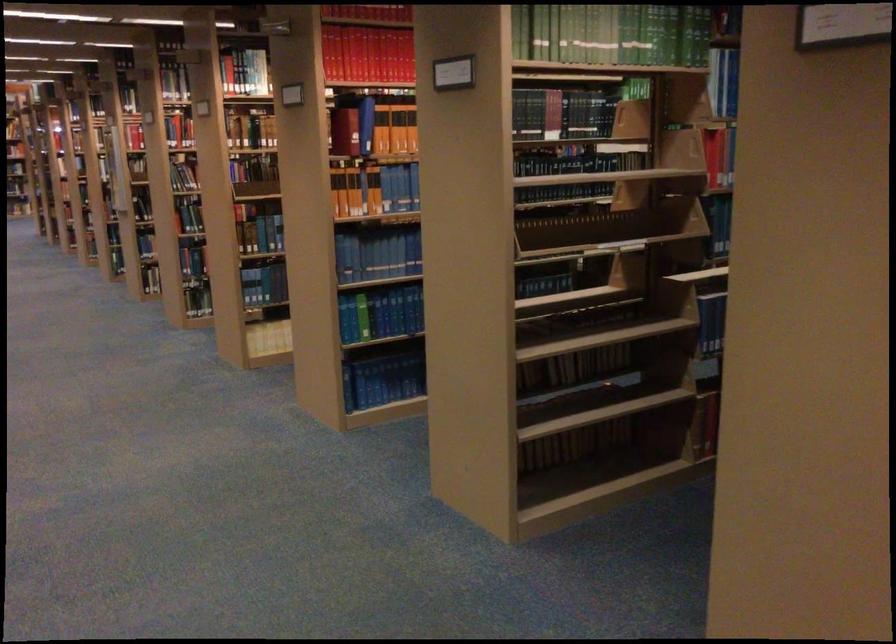
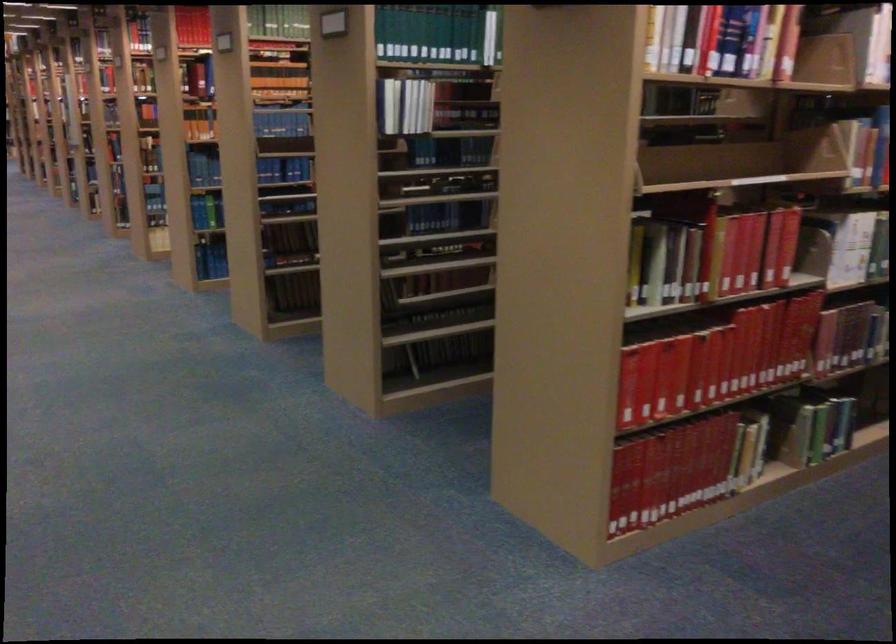
Find the pixel in the second image that matches (375,297) in the first image.

(211, 212)